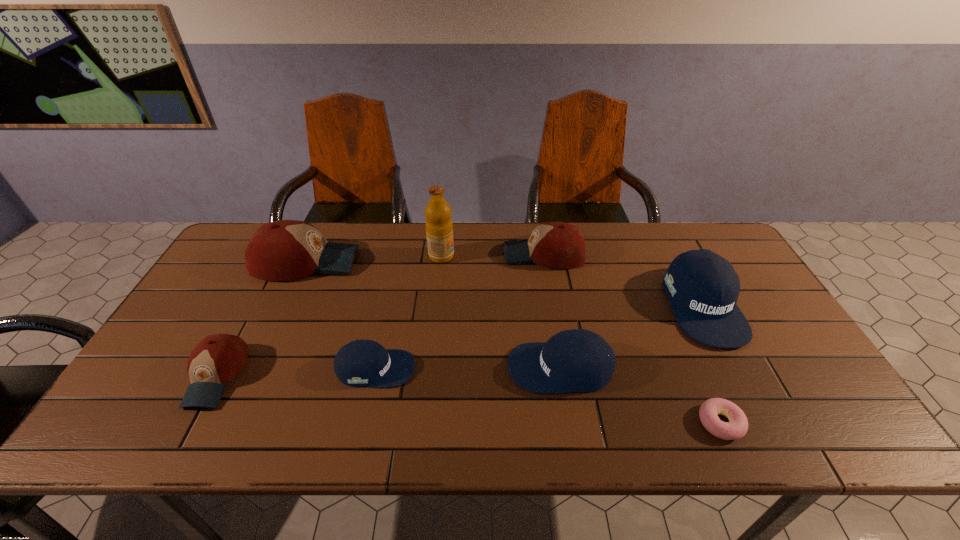
You are a GUI agent. You are given a task and a screenshot of the screen. Output one action in this format:
    pyautogui.click(x=<x>, y=<y>)
    Task: Click on the fruit juice
    
    Given the screenshot: What is the action you would take?
    pyautogui.click(x=439, y=228)

The image size is (960, 540). Identify the location of the biggest red baseball cap. (285, 250).

Locate an element on the screen. the rightmost baseball cap is located at coordinates (703, 287).

Locate an element on the screen. This screenshot has width=960, height=540. the biggest blue baseball cap is located at coordinates (703, 287).

This screenshot has width=960, height=540. I want to click on the rightmost red baseball cap, so click(x=559, y=245).

Where is `the second blue baseball cap from right to left`? This screenshot has height=540, width=960. the second blue baseball cap from right to left is located at coordinates (577, 360).

I want to click on the nearest red baseball cap, so click(217, 359).

This screenshot has width=960, height=540. Find the location of `the smallest blue baseball cap`. the smallest blue baseball cap is located at coordinates click(360, 363).

The image size is (960, 540). I want to click on the leftmost blue baseball cap, so click(360, 363).

Find the location of a particular element. The height and width of the screenshot is (540, 960). the shortest object is located at coordinates (736, 428).